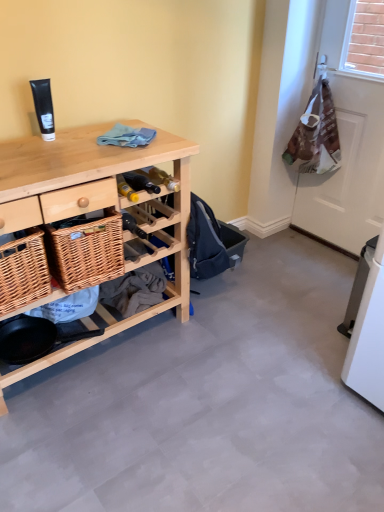
The image size is (384, 512). I want to click on vacant space that is in between black matte tube at upper left and blue cotton cloth at center, so click(89, 136).